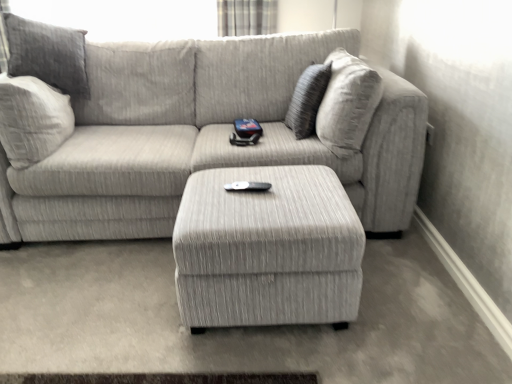
Question: From a real-world perspective, is textured gray couch at center on plaid fabric curtain at upper center?

Choices:
 (A) no
 (B) yes

Answer: (A)

Question: Is textured gray couch at center positioned before plaid fabric curtain at upper center?

Choices:
 (A) yes
 (B) no

Answer: (A)

Question: Does textured gray couch at center appear on the right side of plaid fabric curtain at upper center?

Choices:
 (A) yes
 (B) no

Answer: (B)

Question: Does textured gray couch at center have a greater height compared to plaid fabric curtain at upper center?

Choices:
 (A) yes
 (B) no

Answer: (A)

Question: Is textured gray couch at center shorter than plaid fabric curtain at upper center?

Choices:
 (A) yes
 (B) no

Answer: (B)

Question: Based on their positions, is plaid fabric curtain at upper center located to the left or right of textured gray couch at center?

Choices:
 (A) right
 (B) left

Answer: (A)

Question: Does point (244, 18) appear closer or farther from the camera than point (173, 140)?

Choices:
 (A) farther
 (B) closer

Answer: (A)

Question: Looking at their shapes, would you say plaid fabric curtain at upper center is wider or thinner than textured gray couch at center?

Choices:
 (A) thin
 (B) wide

Answer: (A)

Question: Looking at the image, does plaid fabric curtain at upper center seem bigger or smaller compared to textured gray couch at center?

Choices:
 (A) big
 (B) small

Answer: (B)

Question: Considering the relative positions of beige fabric pillow at upper right and plaid fabric curtain at upper center in the image provided, is beige fabric pillow at upper right to the left or to the right of plaid fabric curtain at upper center?

Choices:
 (A) left
 (B) right

Answer: (B)

Question: Do you think beige fabric pillow at upper right is within plaid fabric curtain at upper center, or outside of it?

Choices:
 (A) outside
 (B) inside

Answer: (A)

Question: From a real-world perspective, is beige fabric pillow at upper right positioned above or below plaid fabric curtain at upper center?

Choices:
 (A) below
 (B) above

Answer: (A)

Question: Is beige fabric pillow at upper right taller or shorter than plaid fabric curtain at upper center?

Choices:
 (A) tall
 (B) short

Answer: (A)

Question: Looking at their shapes, would you say plaid fabric curtain at upper center is wider or thinner than textured gray ottoman at center?

Choices:
 (A) thin
 (B) wide

Answer: (A)

Question: Considering their positions, is plaid fabric curtain at upper center located in front of or behind textured gray ottoman at center?

Choices:
 (A) front
 (B) behind

Answer: (B)